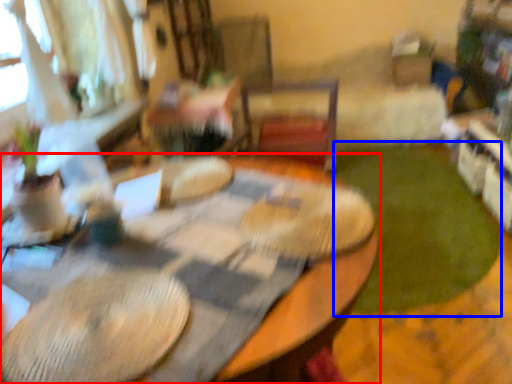
Question: Among these objects, which one is farthest to the camera, table (highlighted by a red box) or grass (highlighted by a blue box)?

Choices:
 (A) table
 (B) grass

Answer: (B)